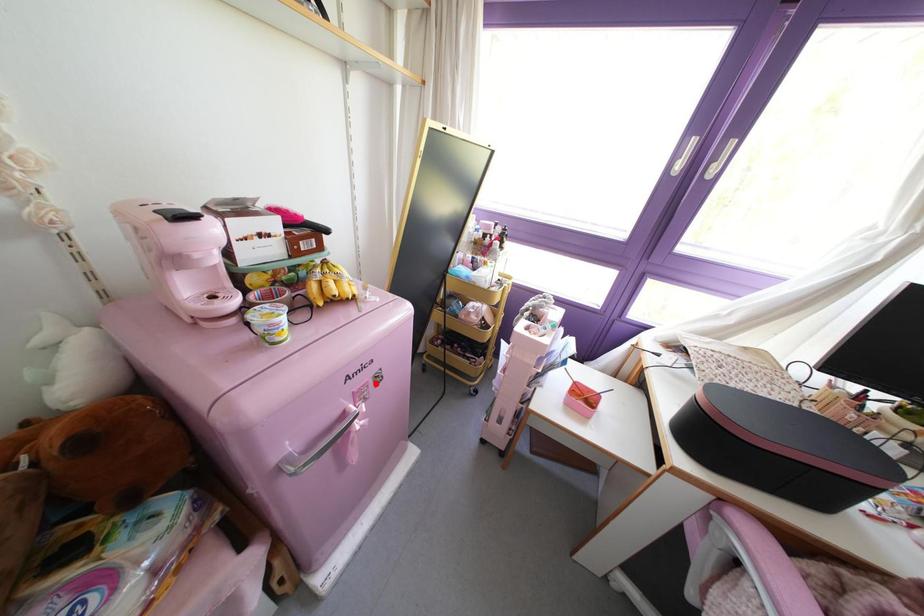
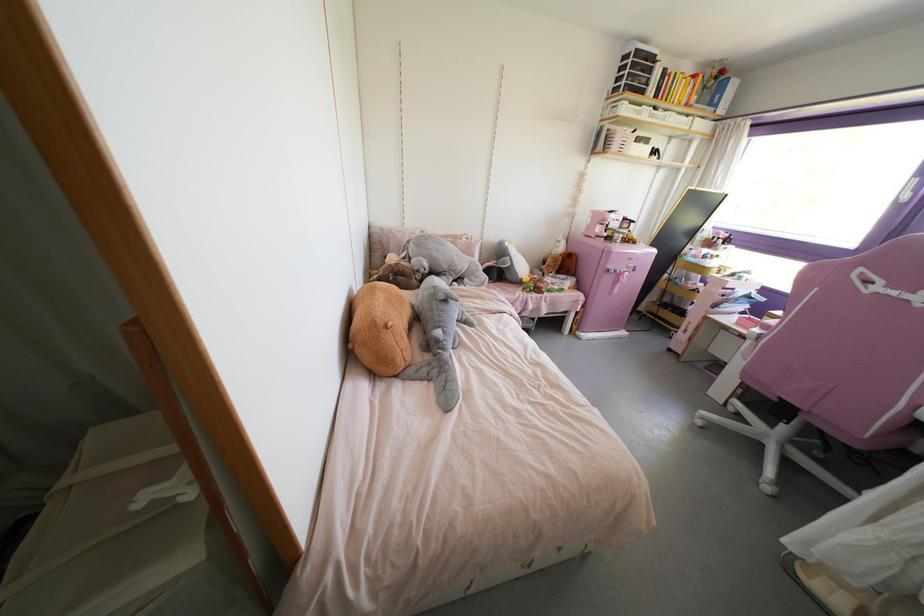
Find the pixel in the second image that matches the highlighted location in the first image.

(633, 270)